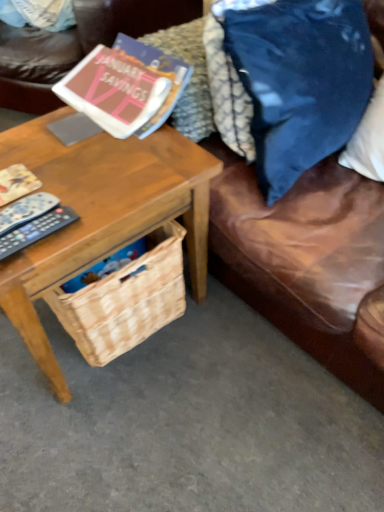
Identify the location of free spot to the right of black plastic remote at left, the 2th remote control from the bottom. This screenshot has width=384, height=512. 102,203.